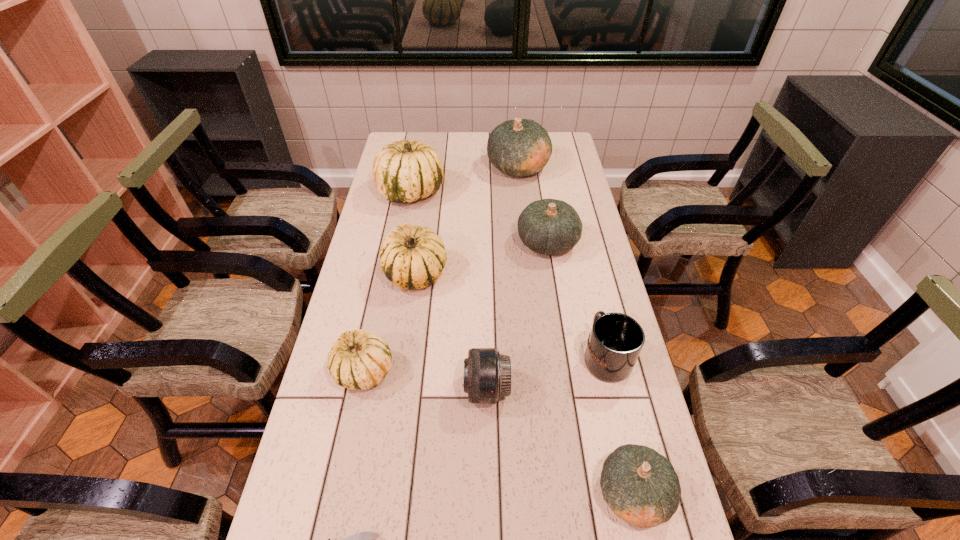
Find the location of a particular element. This screenshot has height=540, width=960. free space between the black mug and the farthest white gourd is located at coordinates (508, 274).

The width and height of the screenshot is (960, 540). I want to click on free space between the fifth farthest gourd and the biggest white gourd, so pyautogui.click(x=387, y=282).

Where is `vacant area that lies between the mug and the second nearest white gourd`? The height and width of the screenshot is (540, 960). vacant area that lies between the mug and the second nearest white gourd is located at coordinates (511, 315).

You are a GUI agent. You are given a task and a screenshot of the screen. Output one action in this format:
    pyautogui.click(x=<x>, y=<y>)
    Task: Click on the vacant space that is in between the mug and the second biggest orange gourd
    
    Given the screenshot: What is the action you would take?
    pyautogui.click(x=577, y=300)

Locate an element on the screen. Image resolution: width=960 pixels, height=540 pixels. unoccupied area between the biggest white gourd and the smallest white gourd is located at coordinates (387, 282).

Where is `free spot between the telephoto lens and the farthest orange gourd`? The height and width of the screenshot is (540, 960). free spot between the telephoto lens and the farthest orange gourd is located at coordinates (502, 278).

The height and width of the screenshot is (540, 960). Find the location of `the closest object to the farthest white gourd`. the closest object to the farthest white gourd is located at coordinates (521, 147).

Locate which object ranks third in proximity to the smallest white gourd. Please provide its 2D coordinates. Your answer should be formatted as a tuple, i.e. [(x, y)], where the tuple contains the x and y coordinates of a point satisfying the conditions above.

[(363, 539)]

The image size is (960, 540). I want to click on gourd that can be found as the closest to the nearest white gourd, so click(412, 257).

Find the location of `gourd that stands as the fifth closest to the shortest object`. gourd that stands as the fifth closest to the shortest object is located at coordinates (405, 171).